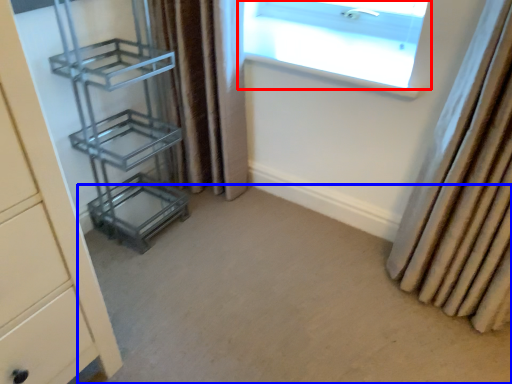
Question: Which of the following is the farthest to the observer, window (highlighted by a red box) or plain (highlighted by a blue box)?

Choices:
 (A) window
 (B) plain

Answer: (A)